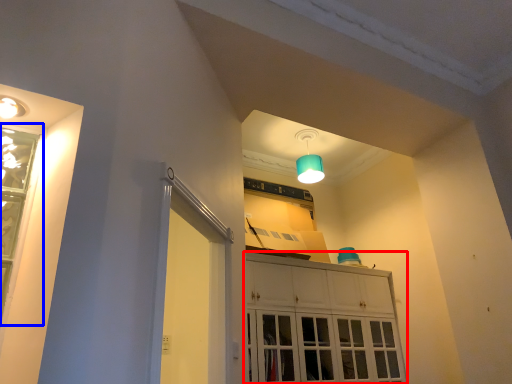
Question: Among these objects, which one is nearest to the camera, cabinetry (highlighted by a red box) or window (highlighted by a blue box)?

Choices:
 (A) cabinetry
 (B) window

Answer: (B)